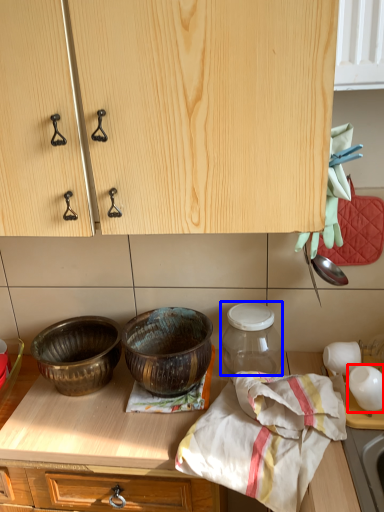
Question: Which object is closer to the camera taking this photo, tableware (highlighted by a red box) or glass jar (highlighted by a blue box)?

Choices:
 (A) tableware
 (B) glass jar

Answer: (A)